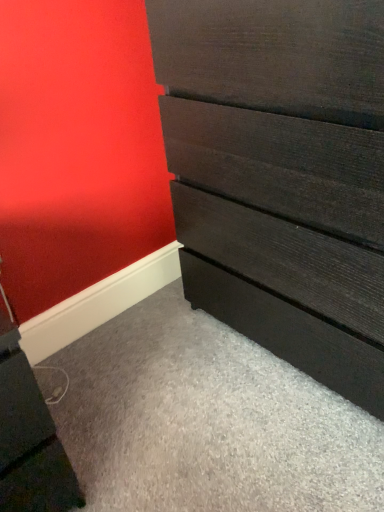
Question: Relative to matte black file cabinet at lower left, is dark wood chest of drawers at center in front or behind?

Choices:
 (A) behind
 (B) front

Answer: (B)

Question: In terms of width, does dark wood chest of drawers at center look wider or thinner when compared to matte black file cabinet at lower left?

Choices:
 (A) thin
 (B) wide

Answer: (B)

Question: Based on their sizes in the image, would you say dark wood chest of drawers at center is bigger or smaller than matte black file cabinet at lower left?

Choices:
 (A) small
 (B) big

Answer: (B)

Question: From a real-world perspective, relative to dark wood chest of drawers at center, is matte black file cabinet at lower left vertically above or below?

Choices:
 (A) above
 (B) below

Answer: (B)

Question: In the image, is matte black file cabinet at lower left on the left side or the right side of dark wood chest of drawers at center?

Choices:
 (A) left
 (B) right

Answer: (A)

Question: From the image's perspective, relative to dark wood chest of drawers at center, is matte black file cabinet at lower left above or below?

Choices:
 (A) below
 (B) above

Answer: (A)

Question: Do you think matte black file cabinet at lower left is within dark wood chest of drawers at center, or outside of it?

Choices:
 (A) inside
 (B) outside

Answer: (B)